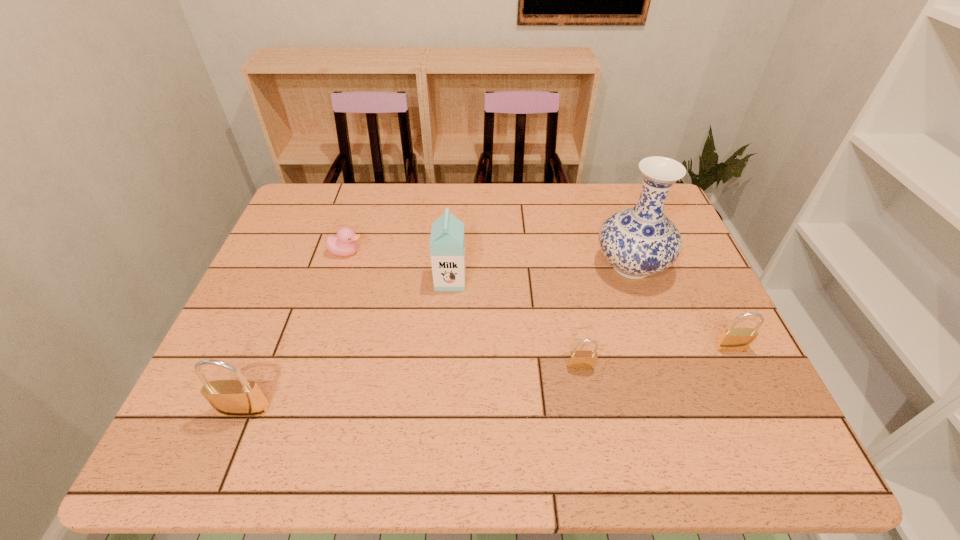
Where is `vase that is at the right edge`? Image resolution: width=960 pixels, height=540 pixels. vase that is at the right edge is located at coordinates (638, 241).

This screenshot has height=540, width=960. In order to click on object present at the near left corner in this screenshot , I will do `click(241, 397)`.

Identify the location of blank space at the far edge of the desktop. (595, 207).

In the image, there is a desktop. Where is `free region at the near edge`? Image resolution: width=960 pixels, height=540 pixels. free region at the near edge is located at coordinates pos(491,381).

I want to click on blank space at the left edge of the desktop, so click(x=261, y=324).

At what (x,y) coordinates should I click in order to perform the action: click on free space at the right edge of the desktop. Please return your answer as a coordinate pair (x, y). Looking at the image, I should click on (655, 289).

Where is `free space at the far left corner of the desktop`? This screenshot has height=540, width=960. free space at the far left corner of the desktop is located at coordinates (337, 188).

The height and width of the screenshot is (540, 960). What are the coordinates of `vacant region at the near left corner of the desktop` in the screenshot? It's located at pyautogui.click(x=202, y=407).

Where is `empty location between the leftmost padlock and the fifth farthest object`? The width and height of the screenshot is (960, 540). empty location between the leftmost padlock and the fifth farthest object is located at coordinates (413, 388).

Where is `vacant area between the tallest padlock and the vase`? The width and height of the screenshot is (960, 540). vacant area between the tallest padlock and the vase is located at coordinates (438, 338).